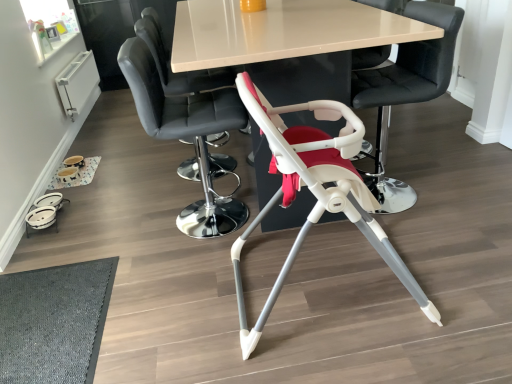
Locate an element on the screen. The width and height of the screenshot is (512, 384). empty space that is in between smooth black chair at center, the second chair when ordered from left to right, and smooth leather chair at upper center, which is the first chair in left-to-right order is located at coordinates (202, 185).